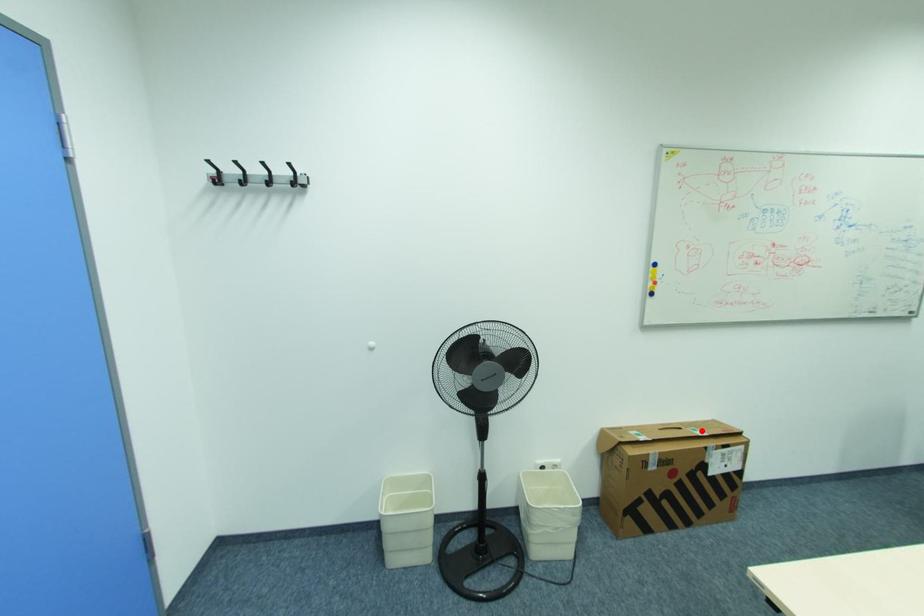
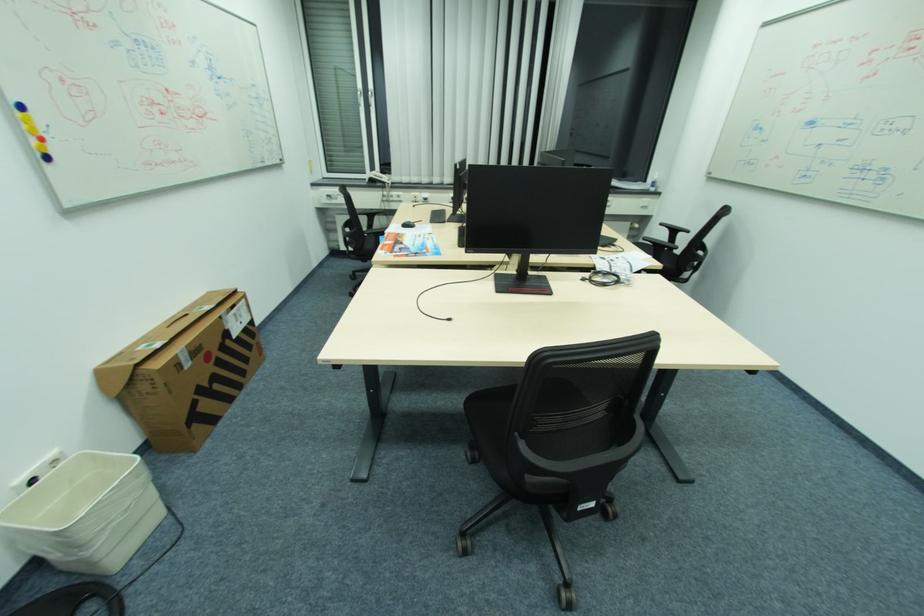
In the second image, find the point that corresponds to the highlighted location in the first image.

(207, 308)